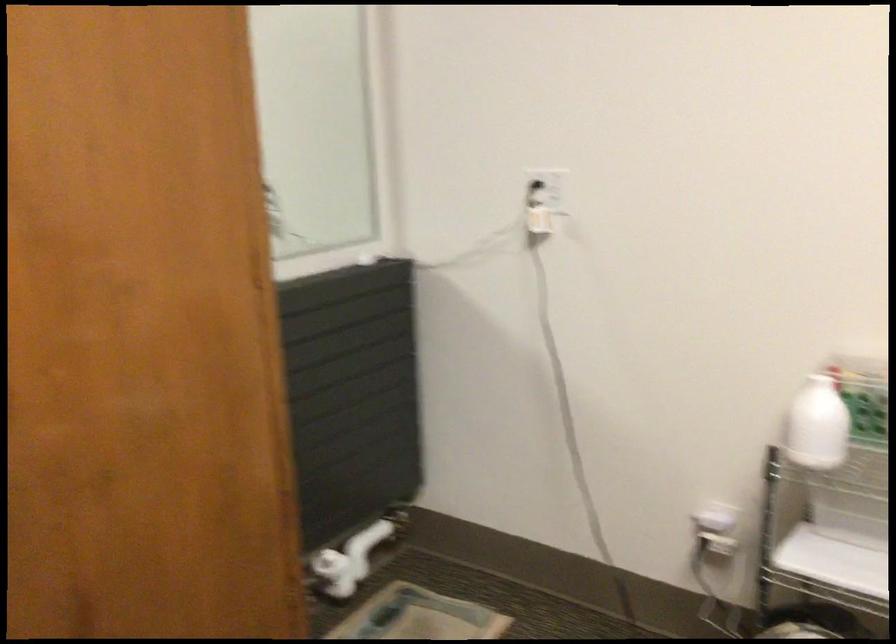
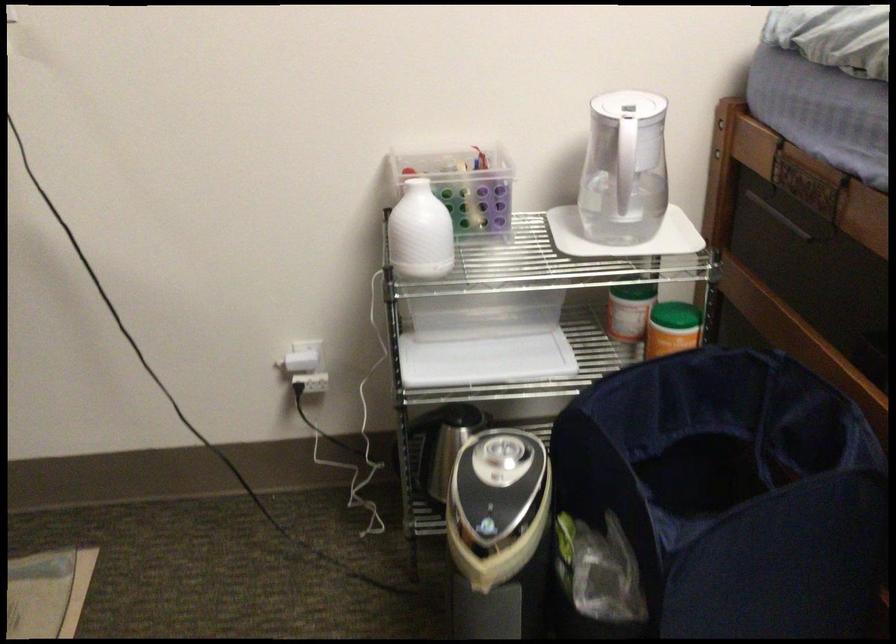
The point at (716,527) is marked in the first image. Where is the corresponding point in the second image?

(306, 366)